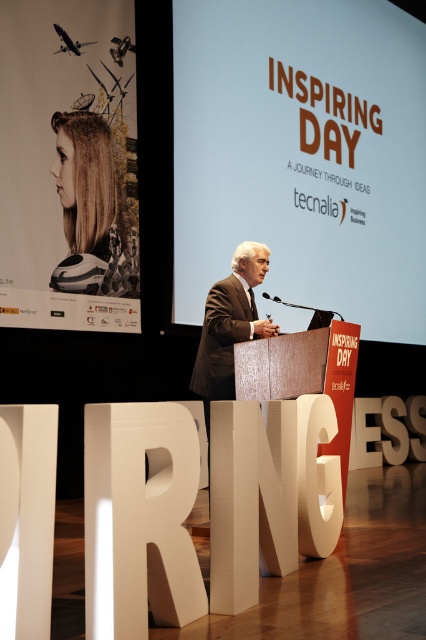
You are an event organizer who needs to adjust the lighting for the presentation. Since the white matte projection screen at upper center and the matte white poster at upper center are both in the same area, which one should you focus the spotlight on to ensure the presentation content is clearly visible?

The white matte projection screen at upper center is located above the matte white poster at upper center, so you should focus the spotlight on the white matte projection screen at upper center to ensure the presentation content is clearly visible.

You are attending the event and want to take a photo of the speaker without the screen in the background. Is the dark brown suit at center visible without the white matte projection screen at upper center obstructing it?

The white matte projection screen at upper center is positioned over the dark brown suit at center, so the screen is blocking the view of the suit. To take a photo without the screen, you would need to move to a different angle or position where the screen is not in front of the suit.

You are an event organizer who needs to ensure the dark brown suit at center is visible to all attendees. Considering the matte white poster at upper center is in front of it, will the poster block the view of the speaker?

The matte white poster at upper center is bigger than dark brown suit at center, so it might block the view of the speaker depending on their position. However, since the poster is at upper center and the suit is at center, the speaker might be standing behind the podium which is off to the right. The poster being larger could partially obscure the upper part, but the main body of the speaker in the dark brown suit at center should remain visible.